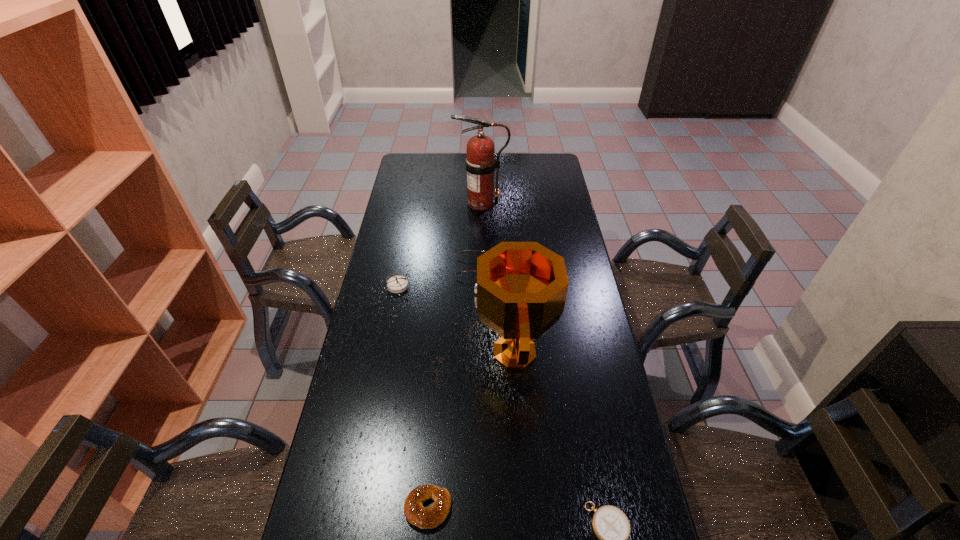
Image resolution: width=960 pixels, height=540 pixels. What are the coordinates of `fire extinguisher` in the screenshot? It's located at (480, 163).

I want to click on the third nearest object, so click(521, 289).

Image resolution: width=960 pixels, height=540 pixels. Identify the location of the farther compass. (396, 284).

Image resolution: width=960 pixels, height=540 pixels. Identify the location of the fourth shortest object. (396, 284).

Locate an element on the screen. Image resolution: width=960 pixels, height=540 pixels. the second farthest object is located at coordinates (466, 250).

Identify the location of bagel. (425, 518).

Locate an element on the screen. Image resolution: width=960 pixels, height=540 pixels. vacant space located at the nozzle of the farthest object is located at coordinates (405, 202).

The height and width of the screenshot is (540, 960). I want to click on free location located at the nozzle of the farthest object, so click(422, 202).

Identify the location of blank space located at the nozzle of the farthest object. (433, 202).

The width and height of the screenshot is (960, 540). In order to click on vacant space located 0.370m on the side of the third nearest object with the star emblem in this screenshot , I will do `click(360, 353)`.